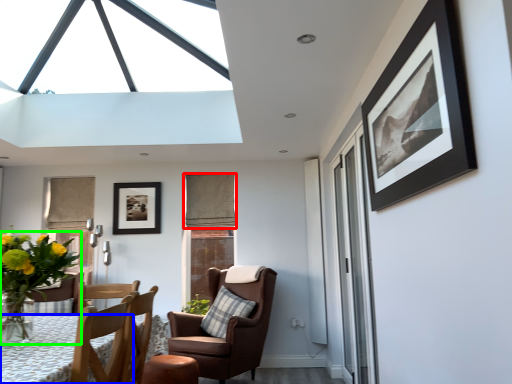
Question: Estimate the real-world distances between objects in this image. Which object is farther from curtain (highlighted by a red box), desk (highlighted by a blue box) or houseplant (highlighted by a green box)?

Choices:
 (A) desk
 (B) houseplant

Answer: (A)